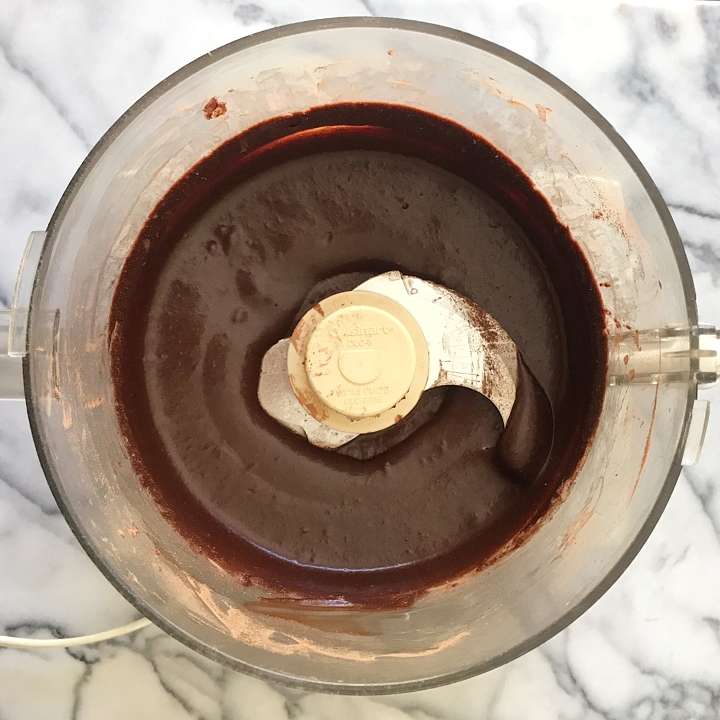
Locate an element on the screen. food processor blade is located at coordinates (378, 389).